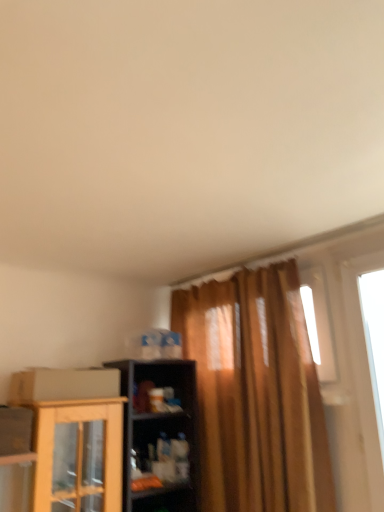
Locate an element on the screen. The height and width of the screenshot is (512, 384). cardboard box at lower left is located at coordinates (63, 384).

Consider the image. How many degrees apart are the facing directions of cardboard box at lower left and matte plastic shelf at center?

There is a 1.36-degree angle between the facing directions of cardboard box at lower left and matte plastic shelf at center.

Does cardboard box at lower left contain matte plastic shelf at center?

That's incorrect, matte plastic shelf at center is not inside cardboard box at lower left.

From a real-world perspective, between cardboard box at lower left and matte plastic shelf at center, who is vertically lower?

matte plastic shelf at center, from a real-world perspective.

Considering the positions of points (102, 378) and (165, 415), is point (102, 378) closer to camera compared to point (165, 415)?

Yes, it is.

From the image's perspective, would you say matte plastic shelf at center is positioned over cardboard box at lower left?

No, from the image's perspective, matte plastic shelf at center is not above cardboard box at lower left.

Looking at their sizes, would you say matte plastic shelf at center is wider or thinner than cardboard box at lower left?

Clearly, matte plastic shelf at center has less width compared to cardboard box at lower left.

Which object is positioned more to the left, matte plastic shelf at center or cardboard box at lower left?

cardboard box at lower left is more to the left.

Consider the image. Considering the sizes of objects matte plastic shelf at center and cardboard box at lower left in the image provided, who is bigger, matte plastic shelf at center or cardboard box at lower left?

cardboard box at lower left.

Is transparent glass window at right turned away from cardboard box at lower left?

No.

Is cardboard box at lower left surrounded by transparent glass window at right?

That's incorrect, cardboard box at lower left is not inside transparent glass window at right.

In the scene shown: Does transparent glass window at right appear on the left side of cardboard box at lower left?

No.

Is point (374, 258) farther from camera compared to point (47, 398)?

Yes, point (374, 258) is farther from viewer.

Is the surface of matte plastic shelf at center in direct contact with transparent glass window at right?

No, matte plastic shelf at center is not in contact with transparent glass window at right.

Is matte plastic shelf at center looking in the opposite direction of transparent glass window at right?

No, matte plastic shelf at center's orientation is not away from transparent glass window at right.

Consider the image. Considering the relative sizes of matte plastic shelf at center and transparent glass window at right in the image provided, is matte plastic shelf at center thinner than transparent glass window at right?

In fact, matte plastic shelf at center might be wider than transparent glass window at right.

From the image's perspective, is matte plastic shelf at center above or below transparent glass window at right?

matte plastic shelf at center is situated lower than transparent glass window at right in the image.

Could transparent glass window at right be considered to be inside cardboard box at lower left?

No, cardboard box at lower left does not contain transparent glass window at right.

Locate an element on the screen. This screenshot has width=384, height=512. cardboard box below the transparent glass window at right (from a real-world perspective) is located at coordinates (63, 384).

From the image's perspective, which one is positioned higher, cardboard box at lower left or transparent glass window at right?

transparent glass window at right.

From a real-world perspective, who is located lower, cardboard box at lower left or transparent glass window at right?

In real-world perspective, cardboard box at lower left is lower.

From the image's perspective, is transparent glass window at right located above or below matte plastic shelf at center?

From the image's perspective, transparent glass window at right appears above matte plastic shelf at center.

Which is correct: transparent glass window at right is inside matte plastic shelf at center, or outside of it?

The correct answer is: outside.

The height and width of the screenshot is (512, 384). In order to click on window in front of the matte plastic shelf at center in this screenshot , I will do `click(367, 340)`.

Based on their sizes in the image, would you say transparent glass window at right is bigger or smaller than matte plastic shelf at center?

Clearly, transparent glass window at right is larger in size than matte plastic shelf at center.

Where is `cardboard box located above the matte plastic shelf at center (from a real-world perspective)`? The height and width of the screenshot is (512, 384). cardboard box located above the matte plastic shelf at center (from a real-world perspective) is located at coordinates (63, 384).

In the image, there is a cardboard box at lower left. In order to click on shelf below it (from a real-world perspective) in this screenshot , I will do [x=160, y=462].

Estimate the real-world distances between objects in this image. Which object is further from matte plastic shelf at center, transparent glass window at right or cardboard box at lower left?

transparent glass window at right is further to matte plastic shelf at center.

Estimate the real-world distances between objects in this image. Which object is further from transparent glass window at right, cardboard box at lower left or matte plastic shelf at center?

cardboard box at lower left is positioned further to the anchor transparent glass window at right.

From the picture: Which object lies nearer to the anchor point cardboard box at lower left, transparent glass window at right or matte plastic shelf at center?

matte plastic shelf at center.

Looking at the image, which one is located closer to matte plastic shelf at center, cardboard box at lower left or transparent glass window at right?

cardboard box at lower left is positioned closer to the anchor matte plastic shelf at center.

Based on their spatial positions, is matte plastic shelf at center or cardboard box at lower left closer to transparent glass window at right?

Among the two, matte plastic shelf at center is located nearer to transparent glass window at right.

Estimate the real-world distances between objects in this image. Which object is further from cardboard box at lower left, matte plastic shelf at center or transparent glass window at right?

transparent glass window at right is further to cardboard box at lower left.

You are a GUI agent. You are given a task and a screenshot of the screen. Output one action in this format:
    pyautogui.click(x=<x>, y=<y>)
    Task: Click on the shelf situated between cardboard box at lower left and transparent glass window at right from left to right
    
    Given the screenshot: What is the action you would take?
    pyautogui.click(x=160, y=462)